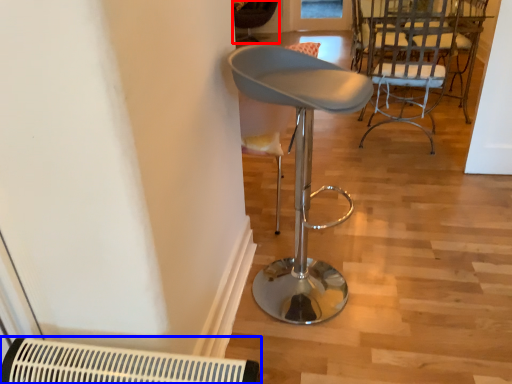
Question: Which object appears farthest to the camera in this image, chair (highlighted by a red box) or air conditioning (highlighted by a blue box)?

Choices:
 (A) chair
 (B) air conditioning

Answer: (A)